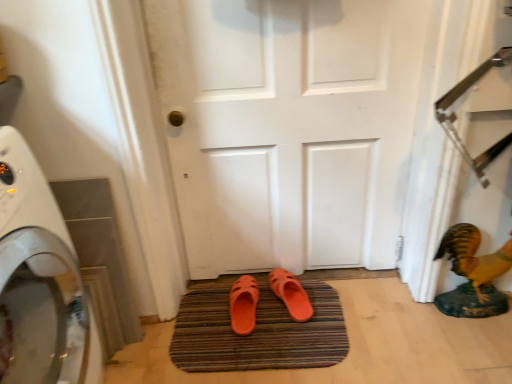
At what (x,y) coordinates should I click in order to perform the action: click on vacant area that is in front of shiny gold statue at lower right. Please return your answer as a coordinate pair (x, y). The image size is (512, 384). Looking at the image, I should click on 478,346.